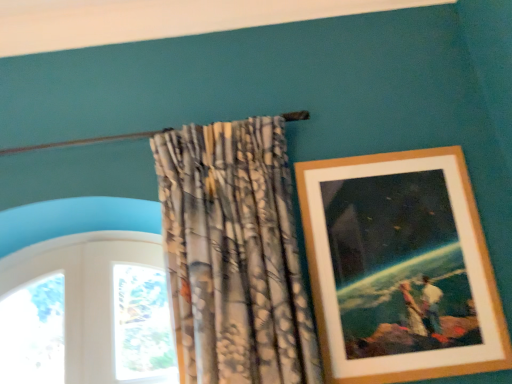
Consider the image. What is the approximate width of wooden picture frame at upper right?

wooden picture frame at upper right is 6.77 centimeters wide.

Describe the element at coordinates (400, 268) in the screenshot. I see `wooden picture frame at upper right` at that location.

What are the coordinates of `wooden picture frame at upper right` in the screenshot? It's located at (400, 268).

What do you see at coordinates (234, 254) in the screenshot? Image resolution: width=512 pixels, height=384 pixels. I see `textured fabric curtain at upper center` at bounding box center [234, 254].

The height and width of the screenshot is (384, 512). I want to click on textured fabric curtain at upper center, so coord(234,254).

In order to face textured fabric curtain at upper center, should I rotate leftwards or rightwards?

You should look left and rotate roughly 3.322 degrees.

Identify the location of wooden picture frame at upper right. The image size is (512, 384). coord(400,268).

Which object is positioned more to the left, wooden picture frame at upper right or textured fabric curtain at upper center?

textured fabric curtain at upper center is more to the left.

Which object is closer to the camera taking this photo, wooden picture frame at upper right or textured fabric curtain at upper center?

textured fabric curtain at upper center is more forward.

Which is less distant, (449, 195) or (229, 382)?

Point (229, 382)

In the scene shown: From the image's perspective, which one is positioned higher, wooden picture frame at upper right or textured fabric curtain at upper center?

textured fabric curtain at upper center is shown above in the image.

From a real-world perspective, is wooden picture frame at upper right located higher than textured fabric curtain at upper center?

No, from a real-world perspective, wooden picture frame at upper right is not above textured fabric curtain at upper center.

Is wooden picture frame at upper right wider than textured fabric curtain at upper center?

No, wooden picture frame at upper right is not wider than textured fabric curtain at upper center.

Considering the relative sizes of wooden picture frame at upper right and textured fabric curtain at upper center in the image provided, is wooden picture frame at upper right taller than textured fabric curtain at upper center?

No, wooden picture frame at upper right is not taller than textured fabric curtain at upper center.

Considering the sizes of objects wooden picture frame at upper right and textured fabric curtain at upper center in the image provided, who is smaller, wooden picture frame at upper right or textured fabric curtain at upper center?

wooden picture frame at upper right.

Can textured fabric curtain at upper center be found inside wooden picture frame at upper right?

No, wooden picture frame at upper right does not contain textured fabric curtain at upper center.

Would you say wooden picture frame at upper right is a long distance from textured fabric curtain at upper center?

No, there isn't a large distance between wooden picture frame at upper right and textured fabric curtain at upper center.

Is wooden picture frame at upper right facing away from textured fabric curtain at upper center?

No, textured fabric curtain at upper center is not at the back of wooden picture frame at upper right.

Can you tell me how much wooden picture frame at upper right and textured fabric curtain at upper center differ in facing direction?

The angle between the facing direction of wooden picture frame at upper right and the facing direction of textured fabric curtain at upper center is 0.631 degrees.

Locate an element on the screen. The image size is (512, 384). curtain on the left of wooden picture frame at upper right is located at coordinates (234, 254).

Between textured fabric curtain at upper center and wooden picture frame at upper right, which one appears on the left side from the viewer's perspective?

From the viewer's perspective, textured fabric curtain at upper center appears more on the left side.

Between textured fabric curtain at upper center and wooden picture frame at upper right, which one is positioned behind?

Positioned behind is wooden picture frame at upper right.

Between point (298, 265) and point (493, 292), which one is positioned behind?

The point (493, 292) is farther.

From the image's perspective, which one is positioned lower, textured fabric curtain at upper center or wooden picture frame at upper right?

wooden picture frame at upper right.

From a real-world perspective, is textured fabric curtain at upper center located higher than wooden picture frame at upper right?

Yes.

Considering the relative sizes of textured fabric curtain at upper center and wooden picture frame at upper right in the image provided, is textured fabric curtain at upper center thinner than wooden picture frame at upper right?

In fact, textured fabric curtain at upper center might be wider than wooden picture frame at upper right.

Consider the image. Is textured fabric curtain at upper center taller or shorter than wooden picture frame at upper right?

In the image, textured fabric curtain at upper center appears to be taller than wooden picture frame at upper right.

Looking at the image, does textured fabric curtain at upper center seem bigger or smaller compared to wooden picture frame at upper right?

In the image, textured fabric curtain at upper center appears to be larger than wooden picture frame at upper right.

Would you say textured fabric curtain at upper center is outside wooden picture frame at upper right?

That's correct, textured fabric curtain at upper center is outside of wooden picture frame at upper right.

Would you consider textured fabric curtain at upper center to be distant from wooden picture frame at upper right?

No, textured fabric curtain at upper center is not far away from wooden picture frame at upper right.

Is textured fabric curtain at upper center turned away from wooden picture frame at upper right?

No.

How far apart are textured fabric curtain at upper center and wooden picture frame at upper right?

11.56 inches.

Find the location of a particular element. The width and height of the screenshot is (512, 384). curtain above the wooden picture frame at upper right (from a real-world perspective) is located at coordinates (234, 254).

Where is `curtain that appears above the wooden picture frame at upper right (from a real-world perspective)`? The image size is (512, 384). curtain that appears above the wooden picture frame at upper right (from a real-world perspective) is located at coordinates (234, 254).

The image size is (512, 384). In the image, there is a textured fabric curtain at upper center. What are the coordinates of `picture frame below it (from a real-world perspective)` in the screenshot? It's located at (400, 268).